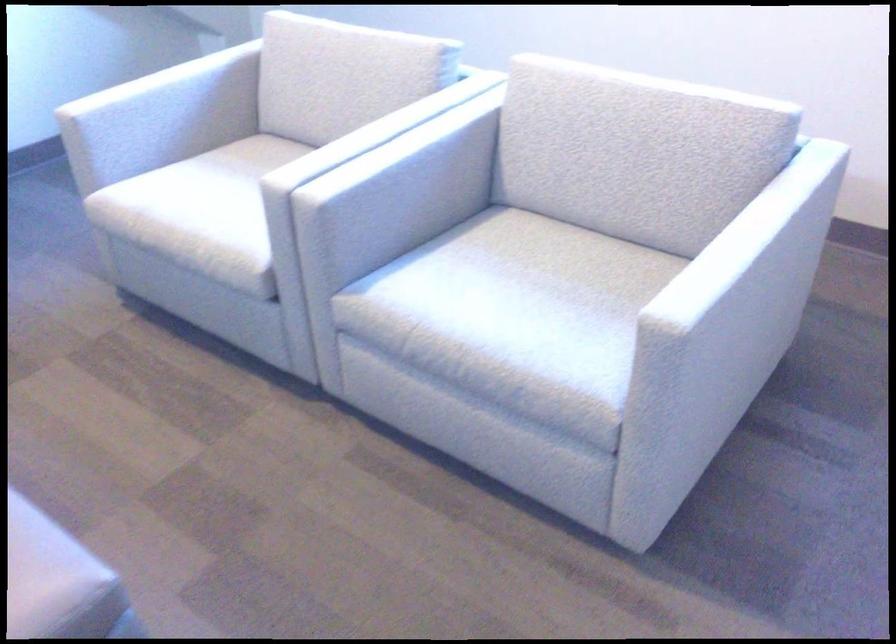
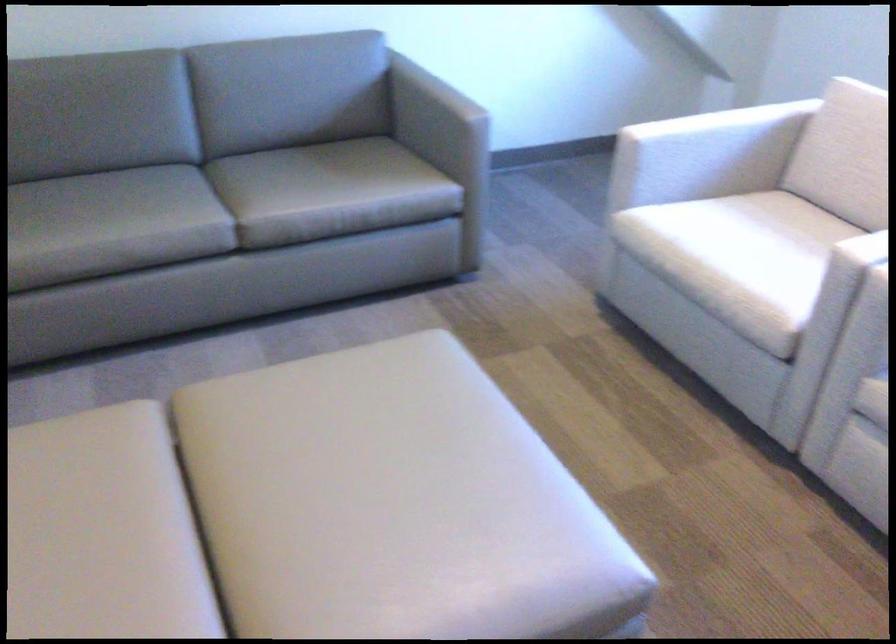
In the second image, find the point that corresponds to point 289,175 in the first image.

(872, 250)